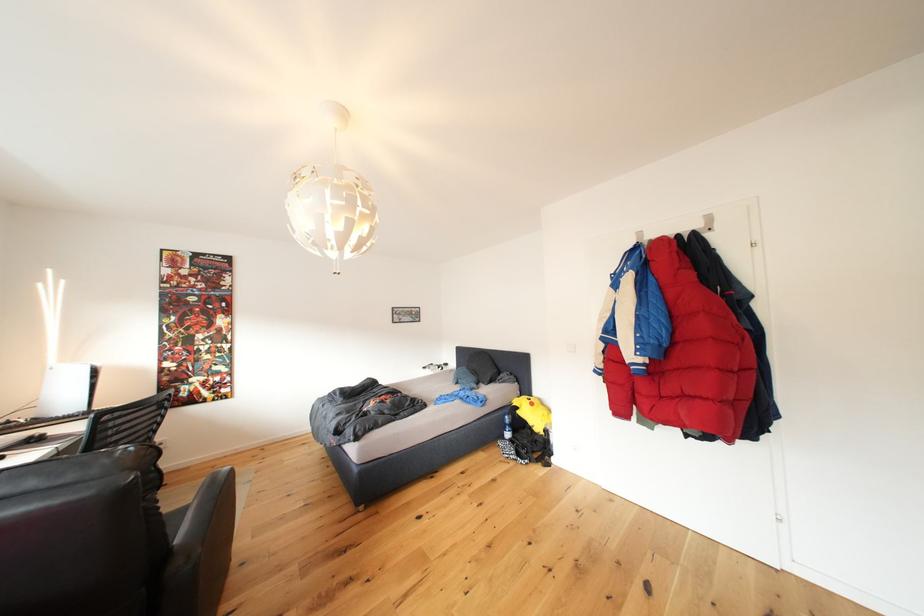
Find where to pull the lamp pull cord. Please return your answer as a coordinate pair (x, y).

(335, 267)